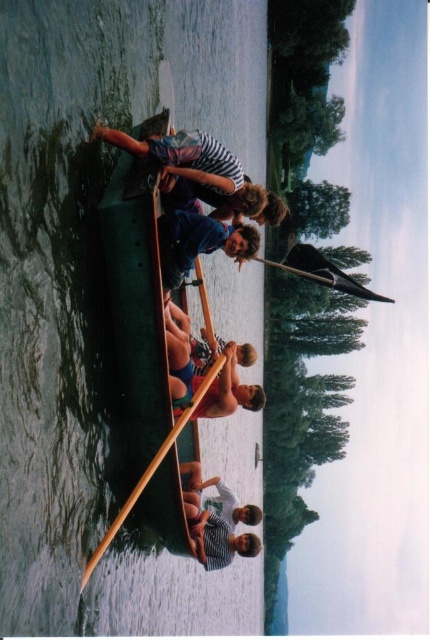
You are a photographer trying to capture a photo of the striped fabric person at upper center and the striped fabric person at center. Since you want both subjects to be in focus, you need to know their vertical positions. Which of the two is positioned higher in the frame?

The striped fabric person at upper center is positioned higher in the frame than the striped fabric person at center.

You are standing on the dock and want to throw a lifebuoy to the striped fabric person at center who is in the boat. The lifebuoy can travel 20 meters. Is the distance within the lifebuoy range?

The striped fabric person at center is 23.30 meters from the viewer, which is beyond the lifebuoy range of 20 meters. The lifebuoy cannot reach them.